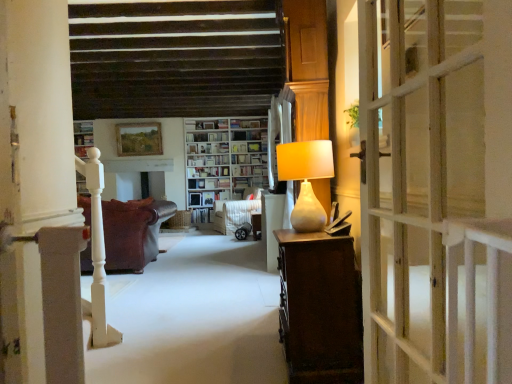
Question: Can you confirm if hardcover book at center, acting as the first book starting from the bottom, is shorter than wooden picture frame at upper center?

Choices:
 (A) no
 (B) yes

Answer: (B)

Question: Does hardcover book at center, the 3th book from the top, turn towards wooden picture frame at upper center?

Choices:
 (A) no
 (B) yes

Answer: (A)

Question: Is hardcover book at center, the 3th book from the top, not within wooden picture frame at upper center?

Choices:
 (A) yes
 (B) no

Answer: (A)

Question: Considering the relative positions of hardcover book at center, the 3th book from the top, and wooden picture frame at upper center in the image provided, is hardcover book at center, the 3th book from the top, to the right of wooden picture frame at upper center from the viewer's perspective?

Choices:
 (A) no
 (B) yes

Answer: (B)

Question: Can you confirm if hardcover book at center, the 3th book from the top, is thinner than wooden picture frame at upper center?

Choices:
 (A) yes
 (B) no

Answer: (B)

Question: Is hardcover book at center, acting as the first book starting from the bottom, further to camera compared to wooden picture frame at upper center?

Choices:
 (A) yes
 (B) no

Answer: (A)

Question: Is matte beige lamp at right smaller than white wooden bookcase at center?

Choices:
 (A) yes
 (B) no

Answer: (A)

Question: Is matte beige lamp at right wider than white wooden bookcase at center?

Choices:
 (A) yes
 (B) no

Answer: (B)

Question: Does matte beige lamp at right come behind white wooden bookcase at center?

Choices:
 (A) no
 (B) yes

Answer: (A)

Question: From the image's perspective, is matte beige lamp at right above white wooden bookcase at center?

Choices:
 (A) yes
 (B) no

Answer: (B)

Question: From the image's perspective, does matte beige lamp at right appear lower than white wooden bookcase at center?

Choices:
 (A) yes
 (B) no

Answer: (A)

Question: Is matte beige lamp at right far away from white wooden bookcase at center?

Choices:
 (A) yes
 (B) no

Answer: (A)

Question: Does leather couch at left come behind white wooden bookcase at center?

Choices:
 (A) no
 (B) yes

Answer: (A)